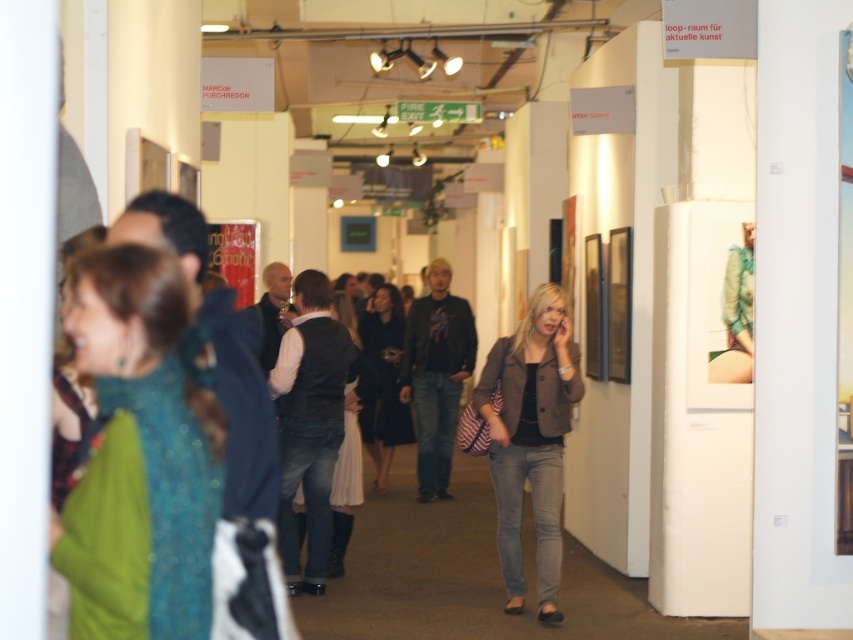
Question: Does matte brown blazer at center appear on the left side of black dress at center?

Choices:
 (A) yes
 (B) no

Answer: (B)

Question: Which of the following is the farthest from the observer?

Choices:
 (A) (379, 365)
 (B) (113, 616)

Answer: (A)

Question: Does green sequined dress at left appear on the right side of black dress at center?

Choices:
 (A) no
 (B) yes

Answer: (A)

Question: Does matte brown blazer at center have a smaller size compared to black dress at center?

Choices:
 (A) yes
 (B) no

Answer: (A)

Question: Which of the following is the farthest from the observer?

Choices:
 (A) pyautogui.click(x=108, y=328)
 (B) pyautogui.click(x=378, y=296)
 (C) pyautogui.click(x=531, y=308)

Answer: (B)

Question: Which point appears farthest from the camera in this image?

Choices:
 (A) (383, 360)
 (B) (151, 538)
 (C) (503, 524)

Answer: (A)